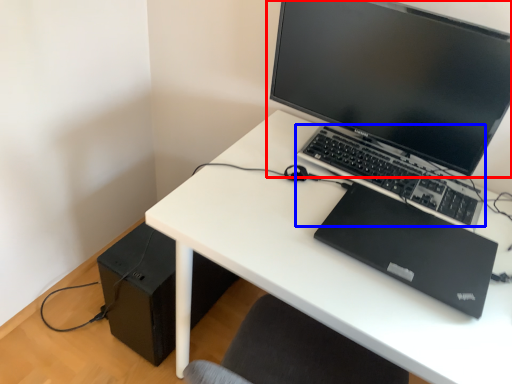
Question: Which of the following is the farthest to the observer, computer monitor (highlighted by a red box) or computer keyboard (highlighted by a blue box)?

Choices:
 (A) computer monitor
 (B) computer keyboard

Answer: (B)